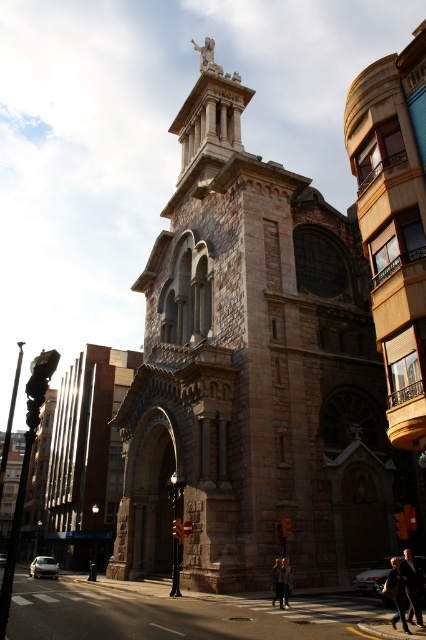
Question: Does brown stone tower at center appear on the left side of blonde hair person at center?

Choices:
 (A) yes
 (B) no

Answer: (A)

Question: Which point is farther from the camera taking this photo?

Choices:
 (A) 419,580
 (B) 287,557
 (C) 279,573

Answer: (B)

Question: Which object appears farthest from the camera in this image?

Choices:
 (A) dark brown leather jacket at center
 (B) dark gray coat at center

Answer: (A)

Question: Which object appears closest to the camera in this image?

Choices:
 (A) blonde hair person at center
 (B) dark brown leather jacket at center
 (C) dark gray coat at center
 (D) brown stone tower at center

Answer: (C)

Question: Does brown stone tower at center have a greater width compared to dark gray suit at center?

Choices:
 (A) yes
 (B) no

Answer: (A)

Question: Where is dark gray coat at center located in relation to dark brown leather jacket at center in the image?

Choices:
 (A) below
 (B) above

Answer: (B)